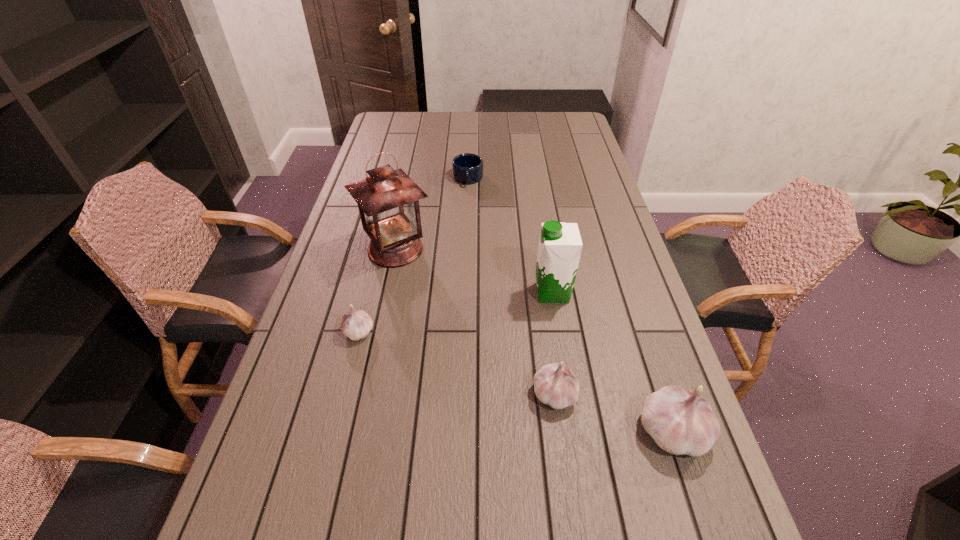
Find the location of a particular element. object that is the third closest to the second farthest object is located at coordinates (560, 244).

You are a GUI agent. You are given a task and a screenshot of the screen. Output one action in this format:
    pyautogui.click(x=<x>, y=<y>)
    Task: Click on the object that ranks as the fourth closest to the rightmost object
    
    Given the screenshot: What is the action you would take?
    pyautogui.click(x=356, y=324)

This screenshot has height=540, width=960. Find the location of `the second closest garlic relative to the third shortest object`. the second closest garlic relative to the third shortest object is located at coordinates (356, 324).

The image size is (960, 540). I want to click on the closest garlic to the leftmost garlic, so (x=555, y=385).

The width and height of the screenshot is (960, 540). I want to click on vacant point that satisfies the following two spatial constraints: 1. on the front side of the oil lamp; 2. on the left side of the second garlic from left to right, so click(x=365, y=394).

This screenshot has width=960, height=540. What are the coordinates of `vacant position in the image that satisfies the following two spatial constraints: 1. with the handle on the side of the second tallest garlic; 2. on the left side of the farthest object` in the screenshot? It's located at (460, 394).

Locate an element on the screen. free point that satisfies the following two spatial constraints: 1. on the front-facing side of the third farthest object; 2. on the front side of the fifth tallest object is located at coordinates (559, 332).

Locate an element on the screen. The image size is (960, 540). free location that satisfies the following two spatial constraints: 1. on the front side of the rightmost object; 2. on the left side of the oil lamp is located at coordinates [x=357, y=431].

Locate an element on the screen. Image resolution: width=960 pixels, height=540 pixels. blank space that satisfies the following two spatial constraints: 1. on the front side of the shortest garlic; 2. on the right side of the rightmost garlic is located at coordinates (333, 431).

The image size is (960, 540). I want to click on vacant position in the image that satisfies the following two spatial constraints: 1. with the handle on the side of the shortest object; 2. on the left side of the fourth tallest object, so click(x=460, y=394).